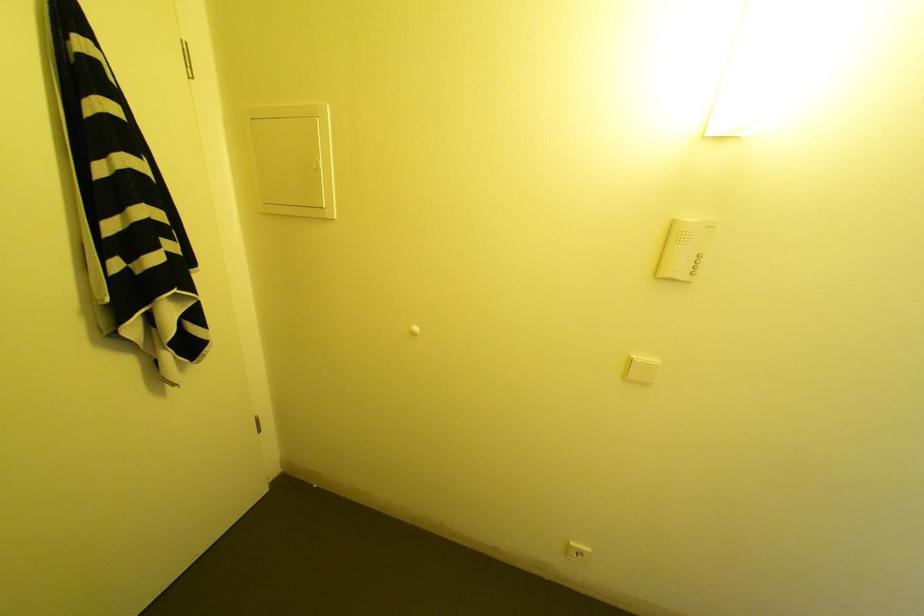
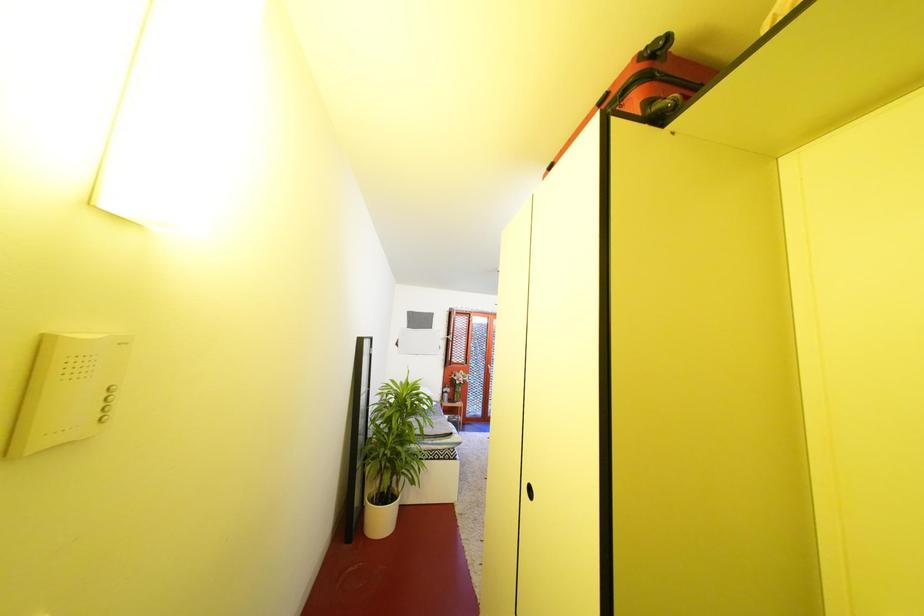
Question: How did the camera likely rotate?

Choices:
 (A) Left
 (B) Right
 (C) Up
 (D) Down

Answer: (B)